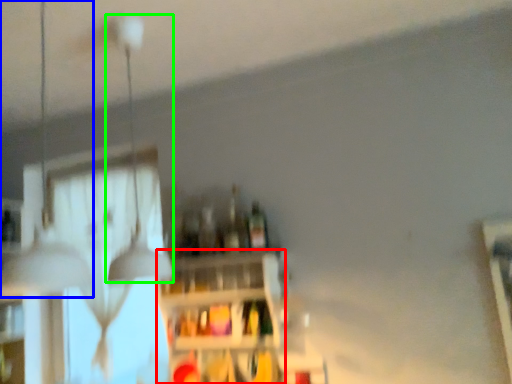
Question: Based on their relative distances, which object is nearer to shelf (highlighted by a red box)? Choose from lamp (highlighted by a blue box) and lamp (highlighted by a green box).

Choices:
 (A) lamp
 (B) lamp

Answer: (B)